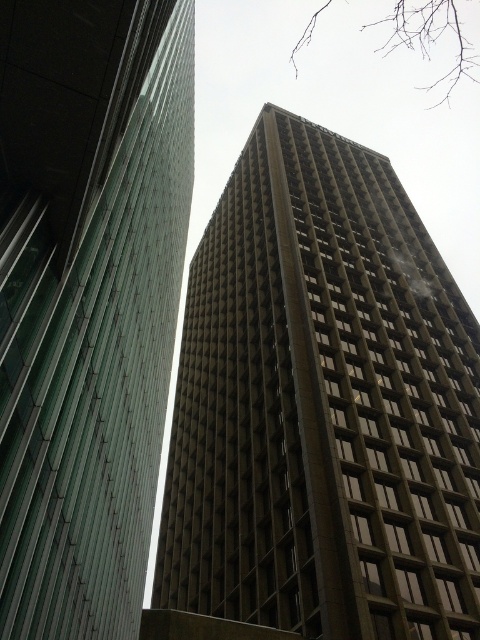
You are a city planner reviewing the architectural plans for a new urban development. You notice the brown concrete building at center and the green glass building at left in the proposed design. Based on their spatial arrangement, which building would cast a shadow over the other during midday when the sun is directly overhead?

The brown concrete building at center is positioned under the green glass building at left, so during midday when the sun is directly overhead, the green glass building at left will cast a shadow over the brown concrete building at center.

You are an architect planning to install solar panels on both the brown concrete building at center and the green glass building at left. Considering their sizes, which building would require more solar panels to cover the same percentage of their roof areas?

The brown concrete building at center has a larger size compared to the green glass building at left, so it would require more solar panels to cover the same percentage of their roof areas.